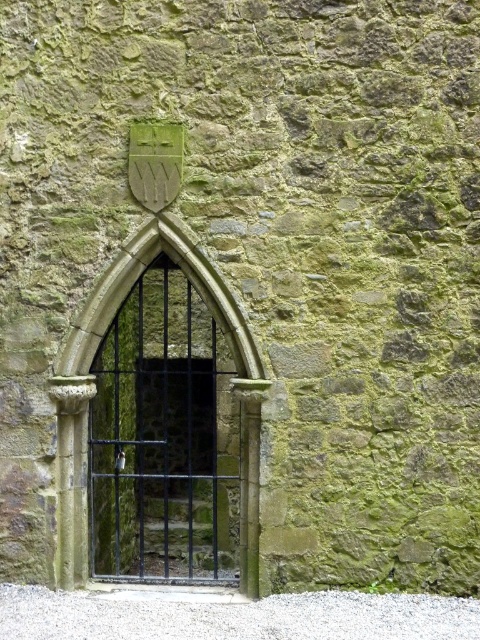
Question: Which object is farther from the camera taking this photo?

Choices:
 (A) white gravel at bottom
 (B) black metal gate at center

Answer: (B)

Question: Which of the following is the farthest from the observer?

Choices:
 (A) (11, 632)
 (B) (202, 289)

Answer: (B)

Question: Can you confirm if white gravel at bottom is thinner than black metal gate at center?

Choices:
 (A) no
 (B) yes

Answer: (A)

Question: Is white gravel at bottom closer to the viewer compared to black metal gate at center?

Choices:
 (A) yes
 (B) no

Answer: (A)

Question: Can you confirm if white gravel at bottom is positioned to the left of black metal gate at center?

Choices:
 (A) no
 (B) yes

Answer: (A)

Question: Which of the following is the closest to the observer?

Choices:
 (A) white gravel at bottom
 (B) black metal gate at center

Answer: (A)